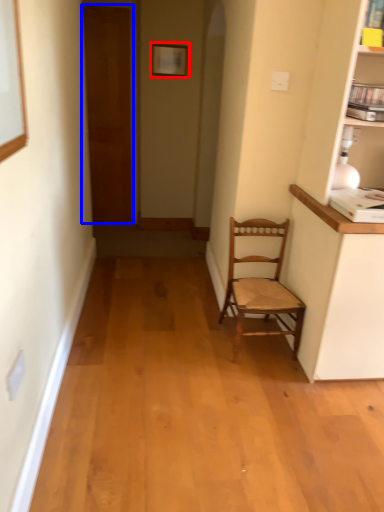
Question: Which of the following is the closest to the observer, picture frame (highlighted by a red box) or door (highlighted by a blue box)?

Choices:
 (A) picture frame
 (B) door

Answer: (A)